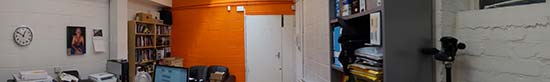
The width and height of the screenshot is (550, 82). In order to click on book shelf in this screenshot , I will do `click(151, 41)`.